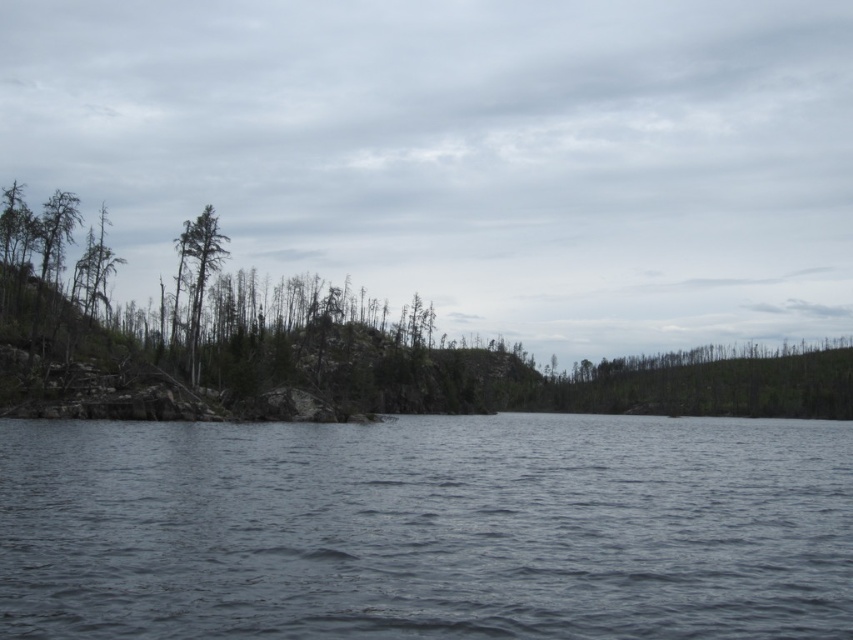
You are a hiker who needs to cross the dark blue water at center to reach the green matte tree at upper left. Given that your backpack can hold up to 100 pounds of equipment, and you need to carry a boat that weighs 80 pounds, is there enough space left in your backpack for a 15 pound first aid kit?

The distance between the dark blue water at center and the green matte tree at upper left is 127.74 feet. However, the question is about backpack capacity. The boat weighs 80 pounds, and the backpack can hold 100 pounds. Subtracting the boat weight from capacity leaves 20 pounds. Since the first aid kit is 15 pounds, there is enough space. Yes, the hiker can carry both the boat and first aid kit.

You are a hiker who wants to cross the dark blue water at center. You notice a green matte tree at upper left nearby. Which object is bigger in size?

The dark blue water at center is larger in size compared to the green matte tree at upper left according to the description.

You are standing at the edge of the rocky shoreline on the left side of the image. You want to reach the dark blue water at center. Which direction should you move in to get there?

The dark blue water at center is located at point (427, 529), so you should move towards the right from the rocky shoreline on the left side to reach it.